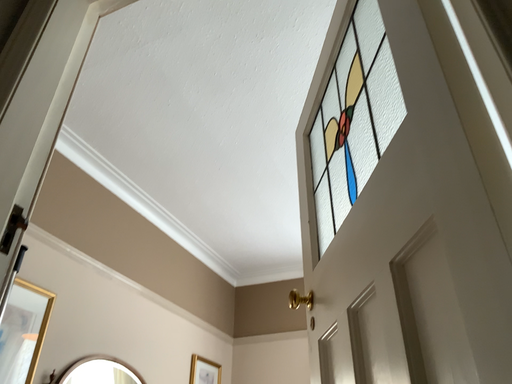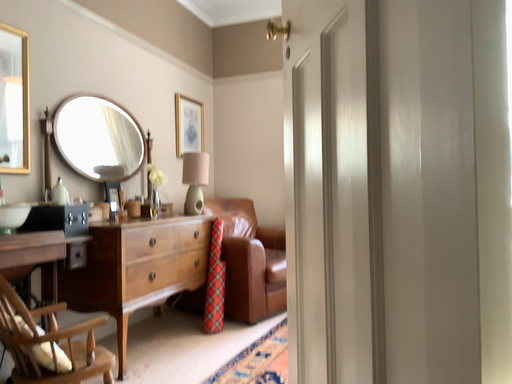
Question: Which way did the camera rotate in the video?

Choices:
 (A) rotated upward
 (B) rotated downward

Answer: (B)